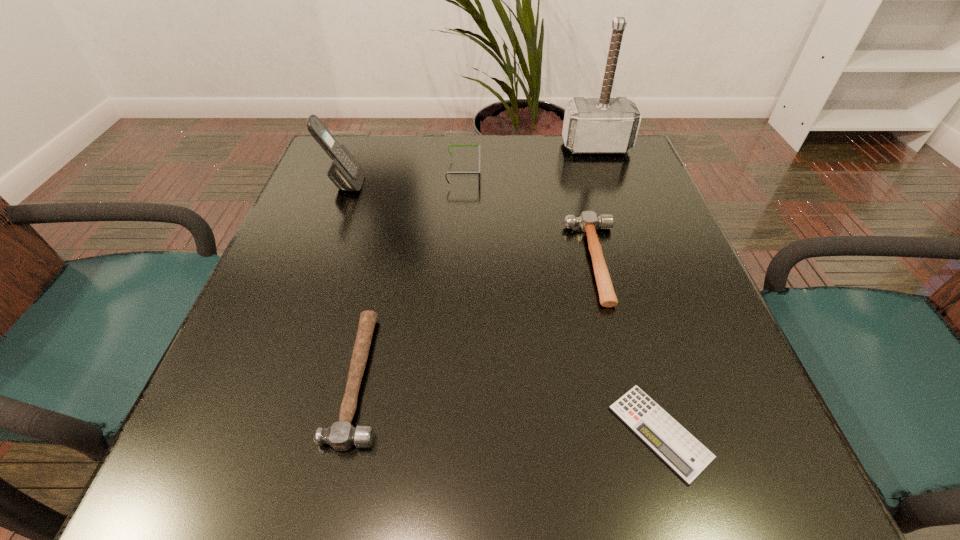
Find the location of a particular element. The height and width of the screenshot is (540, 960). calculator that is at the near edge is located at coordinates (685, 455).

Where is `object that is at the left edge`? Image resolution: width=960 pixels, height=540 pixels. object that is at the left edge is located at coordinates (345, 172).

Locate an element on the screen. calculator that is at the right edge is located at coordinates (685, 455).

Identify the location of object that is at the far left corner. (345, 172).

This screenshot has width=960, height=540. I want to click on object located at the far right corner, so click(x=604, y=125).

Identify the location of object situated at the near right corner. The image size is (960, 540). (685, 455).

Identify the location of free point at the far edge. (471, 158).

This screenshot has height=540, width=960. In the image, there is a desktop. Find the location of `vacant space at the near edge`. vacant space at the near edge is located at coordinates point(584,437).

You are a GUI agent. You are given a task and a screenshot of the screen. Output one action in this format:
    pyautogui.click(x=<x>, y=<y>)
    Task: Click on the vacant space at the left edge of the desktop
    This screenshot has width=960, height=540.
    Given the screenshot: What is the action you would take?
    pyautogui.click(x=287, y=240)

The image size is (960, 540). In order to click on free space at the right edge of the desktop in this screenshot , I will do `click(628, 299)`.